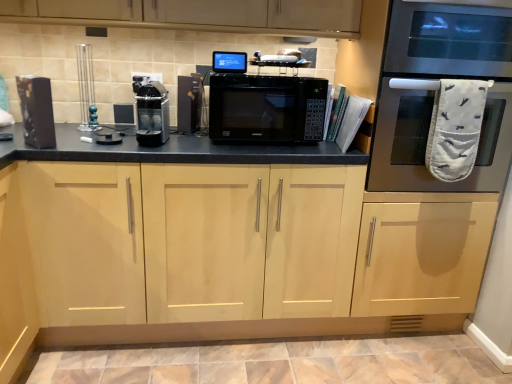
Question: In the image, is light wood cabinet at center on the left side or the right side of black plastic coffee machine at center, which ranks as the 2th appliance in left-to-right order?

Choices:
 (A) right
 (B) left

Answer: (A)

Question: Considering the positions of light wood cabinet at center and black plastic coffee machine at center, which ranks as the 2th appliance in left-to-right order, in the image, is light wood cabinet at center bigger or smaller than black plastic coffee machine at center, which ranks as the 2th appliance in left-to-right order,?

Choices:
 (A) small
 (B) big

Answer: (B)

Question: Based on their relative distances, which object is nearer to the light wood cabinet at center?

Choices:
 (A) black matte microwave at center
 (B) black plastic toaster at center, acting as the 1th appliance starting from the right
 (C) black matte speaker at left, arranged as the 3th appliance when viewed from the right
 (D) stainless steel oven at right
 (E) black plastic coffee machine at center, placed as the 2th appliance when sorted from right to left

Answer: (A)

Question: Which object is positioned closest to the black matte speaker at left, which is counted as the first appliance, starting from the left?

Choices:
 (A) light wood cabinet at center
 (B) stainless steel oven at right
 (C) black plastic toaster at center, acting as the 1th appliance starting from the right
 (D) black matte microwave at center
 (E) black plastic coffee machine at center, placed as the 2th appliance when sorted from right to left

Answer: (E)